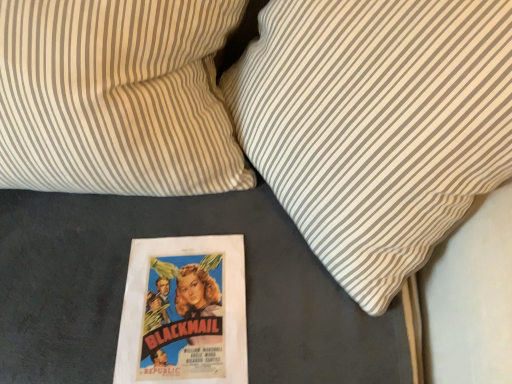
What do you see at coordinates (116, 97) in the screenshot? The width and height of the screenshot is (512, 384). I see `white striped pillow at upper right, which is the second pillow from right to left` at bounding box center [116, 97].

The width and height of the screenshot is (512, 384). I want to click on white striped pillow at upper right, marked as the 1th pillow in a left-to-right arrangement, so click(x=116, y=97).

In order to click on white striped pillow at center, which ranks as the first pillow in right-to-left order in this screenshot , I will do `click(376, 125)`.

How much space does white striped pillow at center, which ranks as the first pillow in right-to-left order, occupy vertically?

white striped pillow at center, which ranks as the first pillow in right-to-left order, is 29.30 inches tall.

Measure the distance between point (400, 213) and camera.

Point (400, 213) and camera are 24.29 inches apart.

Describe the element at coordinates (376, 125) in the screenshot. I see `white striped pillow at center, which ranks as the first pillow in right-to-left order` at that location.

Locate an element on the screen. white striped pillow at upper right, marked as the 1th pillow in a left-to-right arrangement is located at coordinates click(116, 97).

Which is more to the right, white striped pillow at center, which ranks as the first pillow in right-to-left order, or white striped pillow at upper right, marked as the 1th pillow in a left-to-right arrangement?

white striped pillow at center, which ranks as the first pillow in right-to-left order, is more to the right.

Is white striped pillow at center, which ranks as the first pillow in right-to-left order, in front of or behind white striped pillow at upper right, marked as the 1th pillow in a left-to-right arrangement, in the image?

Visually, white striped pillow at center, which ranks as the first pillow in right-to-left order, is located in front of white striped pillow at upper right, marked as the 1th pillow in a left-to-right arrangement.

Considering the points (284, 26) and (199, 144), which point is behind, point (284, 26) or point (199, 144)?

Point (199, 144)

From the image's perspective, which is above, white striped pillow at center, the 2th pillow from the left, or white striped pillow at upper right, marked as the 1th pillow in a left-to-right arrangement?

white striped pillow at upper right, marked as the 1th pillow in a left-to-right arrangement.

From a real-world perspective, which is physically below, white striped pillow at center, which ranks as the first pillow in right-to-left order, or white striped pillow at upper right, marked as the 1th pillow in a left-to-right arrangement?

white striped pillow at upper right, marked as the 1th pillow in a left-to-right arrangement, is physically lower.

Which of these two, white striped pillow at center, which ranks as the first pillow in right-to-left order, or white striped pillow at upper right, which is the second pillow from right to left, is thinner?

Thinner between the two is white striped pillow at upper right, which is the second pillow from right to left.

From their relative heights in the image, would you say white striped pillow at center, the 2th pillow from the left, is taller or shorter than white striped pillow at upper right, marked as the 1th pillow in a left-to-right arrangement?

In the image, white striped pillow at center, the 2th pillow from the left, appears to be taller than white striped pillow at upper right, marked as the 1th pillow in a left-to-right arrangement.

Considering the sizes of objects white striped pillow at center, the 2th pillow from the left, and white striped pillow at upper right, marked as the 1th pillow in a left-to-right arrangement, in the image provided, who is smaller, white striped pillow at center, the 2th pillow from the left, or white striped pillow at upper right, marked as the 1th pillow in a left-to-right arrangement,?

Smaller between the two is white striped pillow at upper right, marked as the 1th pillow in a left-to-right arrangement.

Is white striped pillow at center, which ranks as the first pillow in right-to-left order, inside the boundaries of white striped pillow at upper right, which is the second pillow from right to left, or outside?

white striped pillow at center, which ranks as the first pillow in right-to-left order, is located beyond the bounds of white striped pillow at upper right, which is the second pillow from right to left.

Is white striped pillow at center, the 2th pillow from the left, not close to white striped pillow at upper right, which is the second pillow from right to left?

No, there isn't a large distance between white striped pillow at center, the 2th pillow from the left, and white striped pillow at upper right, which is the second pillow from right to left.

Is white striped pillow at center, which ranks as the first pillow in right-to-left order, oriented away from white striped pillow at upper right, marked as the 1th pillow in a left-to-right arrangement?

No, white striped pillow at center, which ranks as the first pillow in right-to-left order,'s orientation is not away from white striped pillow at upper right, marked as the 1th pillow in a left-to-right arrangement.

How different are the orientations of white striped pillow at center, the 2th pillow from the left, and white striped pillow at upper right, marked as the 1th pillow in a left-to-right arrangement, in degrees?

Answer: The angular difference between white striped pillow at center, the 2th pillow from the left, and white striped pillow at upper right, marked as the 1th pillow in a left-to-right arrangement, is 51.5 degrees.

How far apart are white striped pillow at center, which ranks as the first pillow in right-to-left order, and white striped pillow at upper right, which is the second pillow from right to left?

The distance of white striped pillow at center, which ranks as the first pillow in right-to-left order, from white striped pillow at upper right, which is the second pillow from right to left, is 24.04 centimeters.

Identify the location of pillow that is below the white striped pillow at upper right, marked as the 1th pillow in a left-to-right arrangement (from the image's perspective). (376, 125).

In the scene shown: Which object is positioned more to the right, white striped pillow at upper right, marked as the 1th pillow in a left-to-right arrangement, or white striped pillow at center, the 2th pillow from the left?

white striped pillow at center, the 2th pillow from the left, is more to the right.

Between white striped pillow at upper right, which is the second pillow from right to left, and white striped pillow at center, the 2th pillow from the left, which one is positioned behind?

white striped pillow at upper right, which is the second pillow from right to left, is more distant.

Considering the points (39, 129) and (398, 203), which point is behind, point (39, 129) or point (398, 203)?

The point (39, 129) is farther from the camera.

From the image's perspective, is white striped pillow at upper right, marked as the 1th pillow in a left-to-right arrangement, located beneath white striped pillow at center, which ranks as the first pillow in right-to-left order?

No, from the image's perspective, white striped pillow at upper right, marked as the 1th pillow in a left-to-right arrangement, is not beneath white striped pillow at center, which ranks as the first pillow in right-to-left order.

From a real-world perspective, is white striped pillow at upper right, marked as the 1th pillow in a left-to-right arrangement, positioned above or below white striped pillow at center, which ranks as the first pillow in right-to-left order?

In terms of real-world spatial position, white striped pillow at upper right, marked as the 1th pillow in a left-to-right arrangement, is below white striped pillow at center, which ranks as the first pillow in right-to-left order.

Considering the sizes of white striped pillow at upper right, which is the second pillow from right to left, and white striped pillow at center, which ranks as the first pillow in right-to-left order, in the image, is white striped pillow at upper right, which is the second pillow from right to left, wider or thinner than white striped pillow at center, which ranks as the first pillow in right-to-left order,?

white striped pillow at upper right, which is the second pillow from right to left, is thinner than white striped pillow at center, which ranks as the first pillow in right-to-left order.

Which of these two, white striped pillow at upper right, marked as the 1th pillow in a left-to-right arrangement, or white striped pillow at center, which ranks as the first pillow in right-to-left order, stands taller?

white striped pillow at center, which ranks as the first pillow in right-to-left order, is taller.

Based on their sizes in the image, would you say white striped pillow at upper right, marked as the 1th pillow in a left-to-right arrangement, is bigger or smaller than white striped pillow at center, which ranks as the first pillow in right-to-left order?

Clearly, white striped pillow at upper right, marked as the 1th pillow in a left-to-right arrangement, is smaller in size than white striped pillow at center, which ranks as the first pillow in right-to-left order.

Is white striped pillow at upper right, marked as the 1th pillow in a left-to-right arrangement, inside the boundaries of white striped pillow at center, the 2th pillow from the left, or outside?

white striped pillow at upper right, marked as the 1th pillow in a left-to-right arrangement, is spatially situated outside white striped pillow at center, the 2th pillow from the left.

In the scene shown: Is white striped pillow at upper right, which is the second pillow from right to left, positioned far away from white striped pillow at center, which ranks as the first pillow in right-to-left order?

They are positioned close to each other.

Could you tell me if white striped pillow at upper right, which is the second pillow from right to left, is facing white striped pillow at center, which ranks as the first pillow in right-to-left order?

No, white striped pillow at upper right, which is the second pillow from right to left, is not oriented towards white striped pillow at center, which ranks as the first pillow in right-to-left order.

Can you tell me how much white striped pillow at upper right, which is the second pillow from right to left, and white striped pillow at center, the 2th pillow from the left, differ in facing direction?

The angle between the facing direction of white striped pillow at upper right, which is the second pillow from right to left, and the facing direction of white striped pillow at center, the 2th pillow from the left, is 51.5 degrees.

Locate an element on the screen. The width and height of the screenshot is (512, 384). pillow that appears below the white striped pillow at center, the 2th pillow from the left (from a real-world perspective) is located at coordinates (116, 97).

Locate an element on the screen. pillow that appears in front of the white striped pillow at upper right, marked as the 1th pillow in a left-to-right arrangement is located at coordinates (376, 125).

At what (x,y) coordinates should I click in order to perform the action: click on pillow located above the white striped pillow at center, which ranks as the first pillow in right-to-left order (from the image's perspective). Please return your answer as a coordinate pair (x, y). This screenshot has height=384, width=512. Looking at the image, I should click on (116, 97).